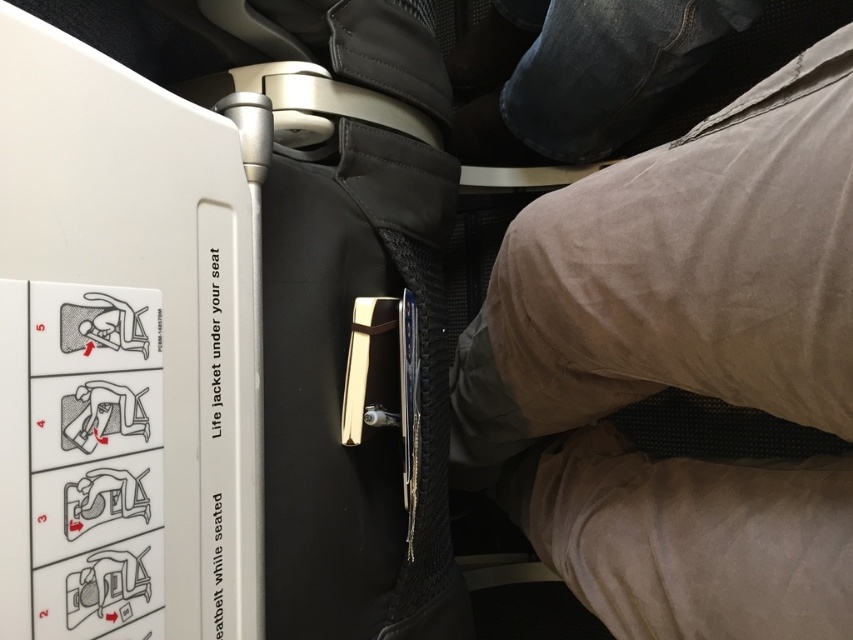
Question: Which point is closer to the camera taking this photo?

Choices:
 (A) (643, 522)
 (B) (103, 364)

Answer: (B)

Question: Considering the relative positions of black mesh bag at center and khaki cotton pants at lower right in the image provided, where is black mesh bag at center located with respect to khaki cotton pants at lower right?

Choices:
 (A) below
 (B) above

Answer: (B)

Question: Is black mesh bag at center below khaki cotton pants at lower right?

Choices:
 (A) no
 (B) yes

Answer: (A)

Question: Can you confirm if black mesh bag at center is positioned below khaki cotton pants at lower right?

Choices:
 (A) no
 (B) yes

Answer: (A)

Question: Which point is closer to the camera?

Choices:
 (A) black mesh bag at center
 (B) khaki cotton pants at lower right

Answer: (A)